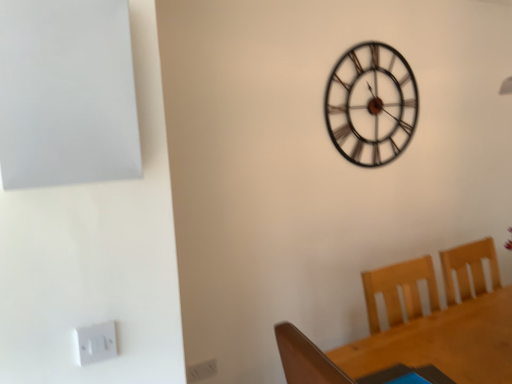
Question: Can you confirm if wooden table at lower right is positioned to the left of metallic black clock at upper center?

Choices:
 (A) no
 (B) yes

Answer: (A)

Question: Does wooden table at lower right lie in front of metallic black clock at upper center?

Choices:
 (A) yes
 (B) no

Answer: (A)

Question: Does wooden table at lower right have a greater width compared to metallic black clock at upper center?

Choices:
 (A) no
 (B) yes

Answer: (B)

Question: Is there a large distance between wooden table at lower right and metallic black clock at upper center?

Choices:
 (A) yes
 (B) no

Answer: (A)

Question: Does wooden table at lower right have a smaller size compared to metallic black clock at upper center?

Choices:
 (A) no
 (B) yes

Answer: (A)

Question: Is wooden table at lower right turned away from metallic black clock at upper center?

Choices:
 (A) no
 (B) yes

Answer: (A)

Question: From the image's perspective, would you say wooden table at lower right is shown under white plastic electric outlet at lower left?

Choices:
 (A) yes
 (B) no

Answer: (A)

Question: Can you confirm if wooden table at lower right is smaller than white plastic electric outlet at lower left?

Choices:
 (A) yes
 (B) no

Answer: (B)

Question: Would you consider wooden table at lower right to be distant from white plastic electric outlet at lower left?

Choices:
 (A) no
 (B) yes

Answer: (B)

Question: Considering the relative sizes of wooden table at lower right and white plastic electric outlet at lower left in the image provided, is wooden table at lower right thinner than white plastic electric outlet at lower left?

Choices:
 (A) no
 (B) yes

Answer: (A)

Question: From the image's perspective, is wooden table at lower right located above white plastic electric outlet at lower left?

Choices:
 (A) no
 (B) yes

Answer: (A)

Question: Is wooden table at lower right facing away from white plastic electric outlet at lower left?

Choices:
 (A) no
 (B) yes

Answer: (A)

Question: Is metallic black clock at upper center positioned beyond the bounds of white plastic electric outlet at lower left?

Choices:
 (A) no
 (B) yes

Answer: (B)